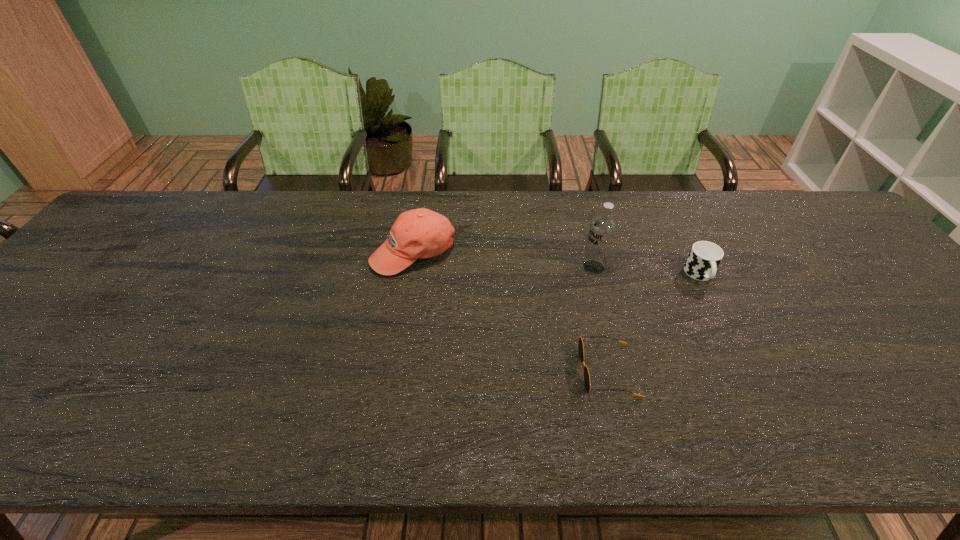
Find the location of `unoccupied area between the sunglasses and the vodka`. unoccupied area between the sunglasses and the vodka is located at coordinates (600, 319).

This screenshot has height=540, width=960. Find the location of `free spot between the rightmost object and the tallest object`. free spot between the rightmost object and the tallest object is located at coordinates (647, 271).

Locate an element on the screen. The width and height of the screenshot is (960, 540). free spot between the shortest object and the tallest object is located at coordinates (600, 319).

Image resolution: width=960 pixels, height=540 pixels. What are the coordinates of `free space between the cup and the tallest object` in the screenshot? It's located at click(x=647, y=271).

The width and height of the screenshot is (960, 540). Find the location of `free space between the vodka and the sunglasses`. free space between the vodka and the sunglasses is located at coordinates (600, 319).

The image size is (960, 540). Identify the location of unoccupied position between the shortest object and the tallest object. (600, 319).

At what (x,y) coordinates should I click in order to perform the action: click on free spot between the sunglasses and the third tallest object. Please return your answer as a coordinate pair (x, y). Looking at the image, I should click on (654, 323).

Where is `free spot between the baseball cap and the rightmost object`? Image resolution: width=960 pixels, height=540 pixels. free spot between the baseball cap and the rightmost object is located at coordinates (557, 264).

Locate an element on the screen. free space that is in between the vodka and the sunglasses is located at coordinates (600, 319).

Where is `the second closest object to the tallest object`? the second closest object to the tallest object is located at coordinates (580, 343).